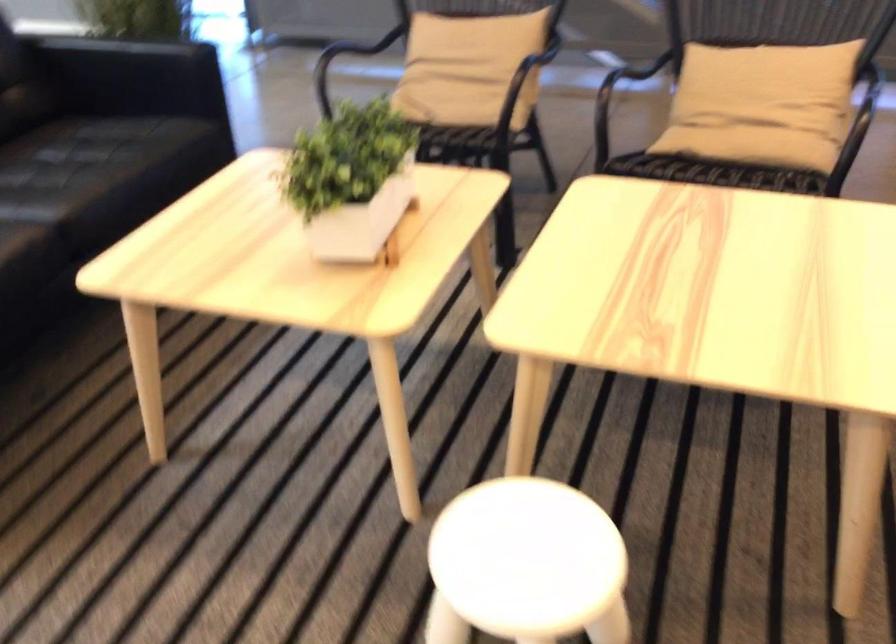
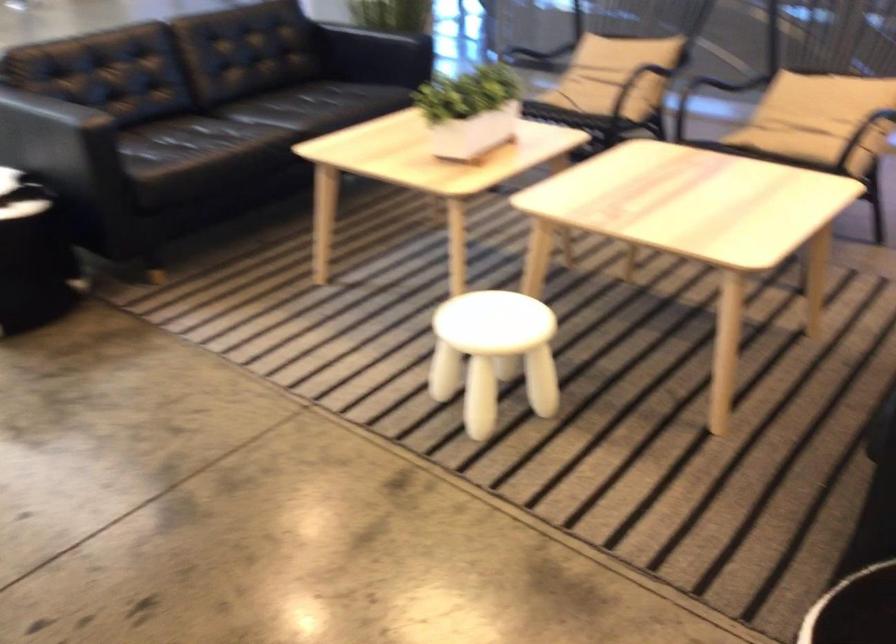
Where in the second image is the point corresponding to (478,100) from the first image?

(597, 91)